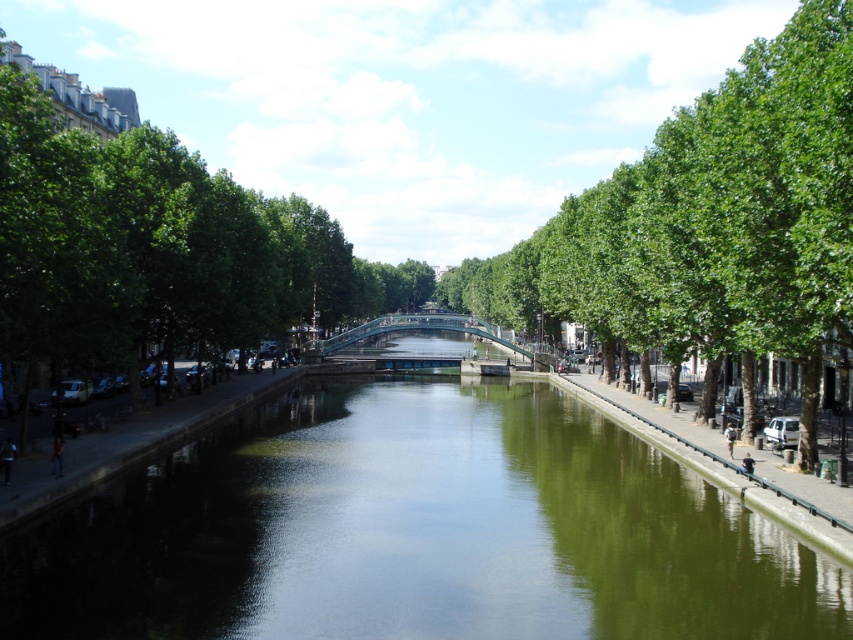
You are standing at the point marked as point (x=91, y=602) and want to walk to the point marked as point (x=705, y=307). Which direction should you move to get closer to your destination?

You should move away from the camera because point (x=91, y=602) is closer to the camera than point (x=705, y=307).

You are a tourist standing on the sidewalk on the left side of the canal. You want to take a photo that includes both the green reflective water at center and the green leafy tree at right. Which object should you position closer to the edge of your camera frame to ensure both fit in the shot?

The green reflective water at center has a lesser width compared to the green leafy tree at right, so you should position the green leafy tree at right closer to the edge of your camera frame to ensure both fit in the shot.